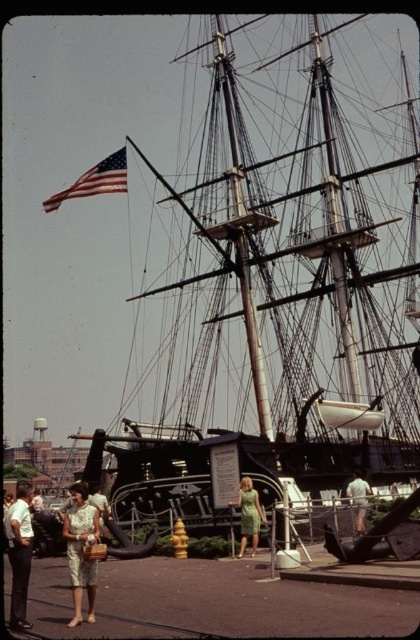
Question: Is printed fabric dress at lower left thinner than green fabric dress at center?

Choices:
 (A) no
 (B) yes

Answer: (A)

Question: Does american flag at upper left lie in front of white fabric shirt at center?

Choices:
 (A) no
 (B) yes

Answer: (A)

Question: Can you confirm if green fabric dress at center is thinner than white fabric shirt at center?

Choices:
 (A) no
 (B) yes

Answer: (A)

Question: Which point is farther from the camera taking this photo?

Choices:
 (A) pyautogui.click(x=357, y=525)
 (B) pyautogui.click(x=121, y=179)
 (C) pyautogui.click(x=15, y=600)

Answer: (B)

Question: Which point appears closest to the camera in this image?

Choices:
 (A) (117, 177)
 (B) (86, 513)
 (C) (23, 528)
 (D) (238, 497)

Answer: (B)

Question: Which is farther from the white fabric shirt at center?

Choices:
 (A) black polished wood ship at center
 (B) american flag at upper left
 (C) printed fabric dress at lower left
 (D) light beige pants at lower left

Answer: (B)